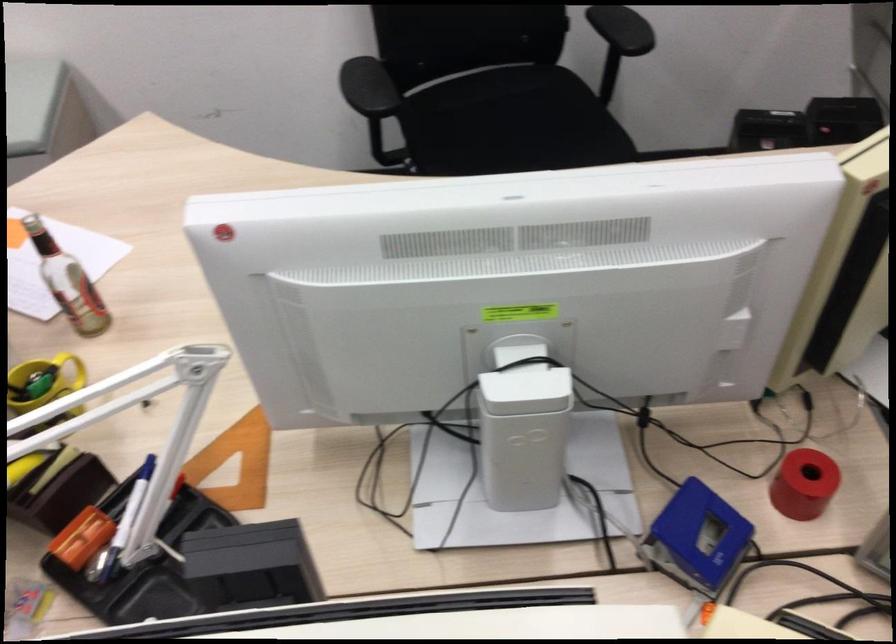
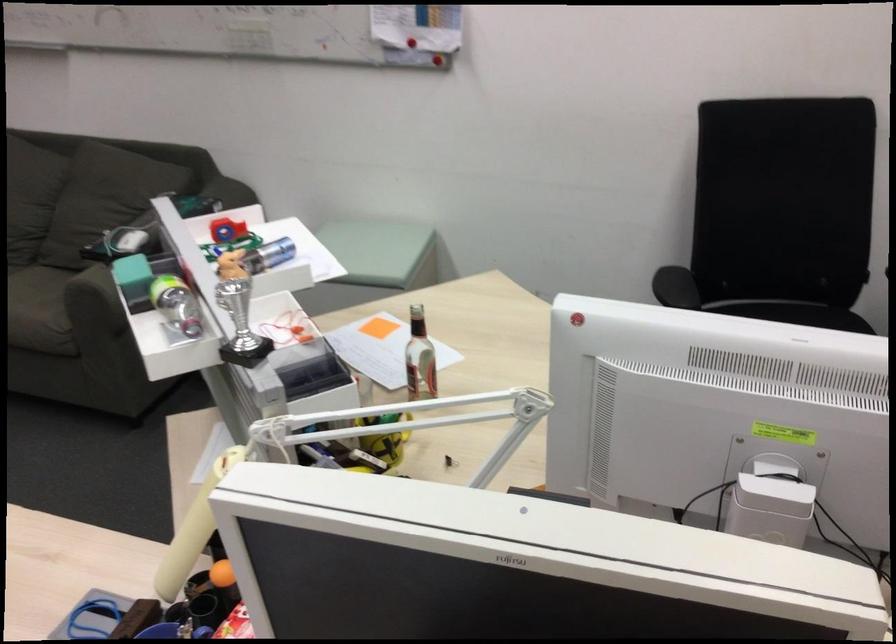
Question: I am providing you with two images of the same scene from different viewpoints. After the viewpoint changes to image2, which objects are now occluded?

Choices:
 (A) red tape dispenser
 (B) plastic water bottle
 (C) blue metal cylinder
 (D) none of these

Answer: (D)